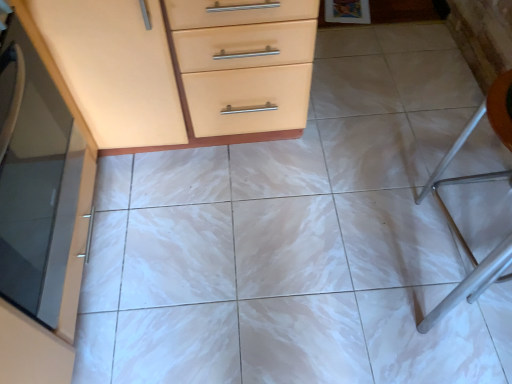
This screenshot has width=512, height=384. What do you see at coordinates (233, 70) in the screenshot? I see `matte wood chest of drawers at upper left, placed as the 2th chest of drawers when sorted from top to bottom` at bounding box center [233, 70].

The width and height of the screenshot is (512, 384). I want to click on orange plastic folding chair at right, so click(472, 130).

Are matte wood chest of drawers at upper left, placed as the 2th chest of drawers when sorted from top to bottom, and matte glass cabinet at left making contact?

No, matte wood chest of drawers at upper left, placed as the 2th chest of drawers when sorted from top to bottom, is not with matte glass cabinet at left.

From a real-world perspective, between matte wood chest of drawers at upper left, placed as the 2th chest of drawers when sorted from top to bottom, and matte glass cabinet at left, who is vertically lower?

In real-world perspective, matte wood chest of drawers at upper left, placed as the 2th chest of drawers when sorted from top to bottom, is lower.

Where is `cabinetry lying behind the matte wood chest of drawers at upper left, marked as the 1th chest of drawers in a bottom-to-top arrangement`? The height and width of the screenshot is (384, 512). cabinetry lying behind the matte wood chest of drawers at upper left, marked as the 1th chest of drawers in a bottom-to-top arrangement is located at coordinates (39, 217).

You are a GUI agent. You are given a task and a screenshot of the screen. Output one action in this format:
    pyautogui.click(x=<x>, y=<y>)
    Task: Click on the chest of drawers above the orange plastic folding chair at right (from a real-world perspective)
    The image size is (512, 384).
    Given the screenshot: What is the action you would take?
    pyautogui.click(x=233, y=70)

Considering the relative sizes of matte wood chest of drawers at upper left, marked as the 1th chest of drawers in a bottom-to-top arrangement, and orange plastic folding chair at right in the image provided, is matte wood chest of drawers at upper left, marked as the 1th chest of drawers in a bottom-to-top arrangement, bigger than orange plastic folding chair at right?

Yes, matte wood chest of drawers at upper left, marked as the 1th chest of drawers in a bottom-to-top arrangement, is bigger than orange plastic folding chair at right.

Is matte wood chest of drawers at upper left, marked as the 1th chest of drawers in a bottom-to-top arrangement, next to orange plastic folding chair at right and touching it?

No, matte wood chest of drawers at upper left, marked as the 1th chest of drawers in a bottom-to-top arrangement, is not making contact with orange plastic folding chair at right.

Between orange plastic folding chair at right and matte orange cabinet at upper left, placed as the 1th chest of drawers when sorted from top to bottom, which one has less height?

With less height is matte orange cabinet at upper left, placed as the 1th chest of drawers when sorted from top to bottom.

Could you tell me if orange plastic folding chair at right is turned towards matte orange cabinet at upper left, placed as the second chest of drawers when sorted from bottom to top?

No, orange plastic folding chair at right does not turn towards matte orange cabinet at upper left, placed as the second chest of drawers when sorted from bottom to top.

Is there a large distance between orange plastic folding chair at right and matte orange cabinet at upper left, placed as the second chest of drawers when sorted from bottom to top?

No, orange plastic folding chair at right is in close proximity to matte orange cabinet at upper left, placed as the second chest of drawers when sorted from bottom to top.

From a real-world perspective, is orange plastic folding chair at right on top of matte orange cabinet at upper left, placed as the second chest of drawers when sorted from bottom to top?

Yes, from a real-world perspective, orange plastic folding chair at right is on top of matte orange cabinet at upper left, placed as the second chest of drawers when sorted from bottom to top.

Is orange plastic folding chair at right far from matte wood chest of drawers at upper left, marked as the 1th chest of drawers in a bottom-to-top arrangement?

No.

From the picture: Considering the relative sizes of orange plastic folding chair at right and matte wood chest of drawers at upper left, placed as the 2th chest of drawers when sorted from top to bottom, in the image provided, is orange plastic folding chair at right thinner than matte wood chest of drawers at upper left, placed as the 2th chest of drawers when sorted from top to bottom,?

Correct, the width of orange plastic folding chair at right is less than that of matte wood chest of drawers at upper left, placed as the 2th chest of drawers when sorted from top to bottom.

Is matte wood chest of drawers at upper left, marked as the 1th chest of drawers in a bottom-to-top arrangement, at the back of orange plastic folding chair at right?

No.

From the image's perspective, would you say orange plastic folding chair at right is positioned over matte wood chest of drawers at upper left, marked as the 1th chest of drawers in a bottom-to-top arrangement?

Yes, from the image's perspective, orange plastic folding chair at right is above matte wood chest of drawers at upper left, marked as the 1th chest of drawers in a bottom-to-top arrangement.

Which of these two, matte orange cabinet at upper left, placed as the second chest of drawers when sorted from bottom to top, or orange plastic folding chair at right, is bigger?

With larger size is matte orange cabinet at upper left, placed as the second chest of drawers when sorted from bottom to top.

From a real-world perspective, between matte orange cabinet at upper left, placed as the second chest of drawers when sorted from bottom to top, and orange plastic folding chair at right, who is vertically higher?

orange plastic folding chair at right, from a real-world perspective.

Considering the positions of objects matte orange cabinet at upper left, placed as the second chest of drawers when sorted from bottom to top, and orange plastic folding chair at right in the image provided, who is behind, matte orange cabinet at upper left, placed as the second chest of drawers when sorted from bottom to top, or orange plastic folding chair at right?

matte orange cabinet at upper left, placed as the second chest of drawers when sorted from bottom to top.

In the scene shown: From the image's perspective, is matte orange cabinet at upper left, placed as the 1th chest of drawers when sorted from top to bottom, positioned above or below orange plastic folding chair at right?

Based on their image positions, matte orange cabinet at upper left, placed as the 1th chest of drawers when sorted from top to bottom, is located above orange plastic folding chair at right.

From a real-world perspective, is matte glass cabinet at left positioned over orange plastic folding chair at right based on gravity?

Yes, from a real-world perspective, matte glass cabinet at left is over orange plastic folding chair at right

Is there a large distance between matte glass cabinet at left and orange plastic folding chair at right?

Yes, matte glass cabinet at left and orange plastic folding chair at right are quite far apart.

From the image's perspective, which one is positioned lower, matte glass cabinet at left or orange plastic folding chair at right?

matte glass cabinet at left.

How many degrees apart are the facing directions of matte glass cabinet at left and orange plastic folding chair at right?

The angle between the facing direction of matte glass cabinet at left and the facing direction of orange plastic folding chair at right is 173 degrees.

How many degrees apart are the facing directions of orange plastic folding chair at right and matte glass cabinet at left?

173 degrees separate the facing orientations of orange plastic folding chair at right and matte glass cabinet at left.

Could you tell me if orange plastic folding chair at right is facing matte glass cabinet at left?

Yes.

In the scene shown: Can you confirm if orange plastic folding chair at right is positioned to the right of matte glass cabinet at left?

Indeed, orange plastic folding chair at right is positioned on the right side of matte glass cabinet at left.

Looking at their sizes, would you say orange plastic folding chair at right is wider or thinner than matte glass cabinet at left?

In the image, orange plastic folding chair at right appears to be wider than matte glass cabinet at left.

At what (x,y) coordinates should I click in order to perform the action: click on the 2nd chest of drawers counting from the right of the matte glass cabinet at left. Please return your answer as a coordinate pair (x, y). The width and height of the screenshot is (512, 384). Looking at the image, I should click on point(233,70).

The width and height of the screenshot is (512, 384). What are the coordinates of `folding chair above the matte wood chest of drawers at upper left, marked as the 1th chest of drawers in a bottom-to-top arrangement (from the image's perspective)` in the screenshot? It's located at (472, 130).

Considering their positions, is matte wood chest of drawers at upper left, placed as the 2th chest of drawers when sorted from top to bottom, positioned closer to matte glass cabinet at left than orange plastic folding chair at right?

matte wood chest of drawers at upper left, placed as the 2th chest of drawers when sorted from top to bottom, lies closer to matte glass cabinet at left than the other object.

In the scene shown: Considering their positions, is orange plastic folding chair at right positioned closer to matte glass cabinet at left than matte orange cabinet at upper left, placed as the second chest of drawers when sorted from bottom to top?

The object closer to matte glass cabinet at left is matte orange cabinet at upper left, placed as the second chest of drawers when sorted from bottom to top.

Consider the image. Considering their positions, is matte orange cabinet at upper left, placed as the second chest of drawers when sorted from bottom to top, positioned closer to matte wood chest of drawers at upper left, placed as the 2th chest of drawers when sorted from top to bottom, than orange plastic folding chair at right?

matte orange cabinet at upper left, placed as the second chest of drawers when sorted from bottom to top, is closer to matte wood chest of drawers at upper left, placed as the 2th chest of drawers when sorted from top to bottom.

Based on their spatial positions, is orange plastic folding chair at right or matte orange cabinet at upper left, placed as the second chest of drawers when sorted from bottom to top, closer to matte wood chest of drawers at upper left, placed as the 2th chest of drawers when sorted from top to bottom?

matte orange cabinet at upper left, placed as the second chest of drawers when sorted from bottom to top.

Considering their positions, is orange plastic folding chair at right positioned further to matte wood chest of drawers at upper left, marked as the 1th chest of drawers in a bottom-to-top arrangement, than matte glass cabinet at left?

The object further to matte wood chest of drawers at upper left, marked as the 1th chest of drawers in a bottom-to-top arrangement, is orange plastic folding chair at right.

Considering their positions, is matte wood chest of drawers at upper left, marked as the 1th chest of drawers in a bottom-to-top arrangement, positioned further to matte orange cabinet at upper left, placed as the 1th chest of drawers when sorted from top to bottom, than matte glass cabinet at left?

matte glass cabinet at left lies further to matte orange cabinet at upper left, placed as the 1th chest of drawers when sorted from top to bottom, than the other object.

When comparing their distances from matte orange cabinet at upper left, placed as the 1th chest of drawers when sorted from top to bottom, does matte glass cabinet at left or orange plastic folding chair at right seem further?

orange plastic folding chair at right.

When comparing their distances from matte wood chest of drawers at upper left, marked as the 1th chest of drawers in a bottom-to-top arrangement, does matte orange cabinet at upper left, placed as the second chest of drawers when sorted from bottom to top, or matte glass cabinet at left seem closer?

matte orange cabinet at upper left, placed as the second chest of drawers when sorted from bottom to top, is positioned closer to the anchor matte wood chest of drawers at upper left, marked as the 1th chest of drawers in a bottom-to-top arrangement.

This screenshot has height=384, width=512. Identify the location of cabinetry located between matte wood chest of drawers at upper left, marked as the 1th chest of drawers in a bottom-to-top arrangement, and matte orange cabinet at upper left, placed as the second chest of drawers when sorted from bottom to top, in the depth direction. (39, 217).

Locate an element on the screen. the chest of drawers situated between matte orange cabinet at upper left, placed as the 1th chest of drawers when sorted from top to bottom, and orange plastic folding chair at right from left to right is located at coordinates (233, 70).